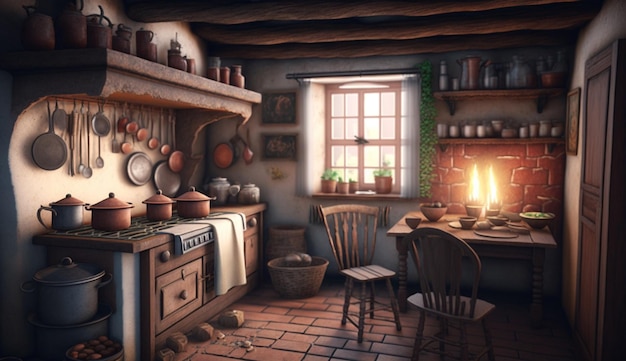
Identify the location of right flower pot. (381, 184).